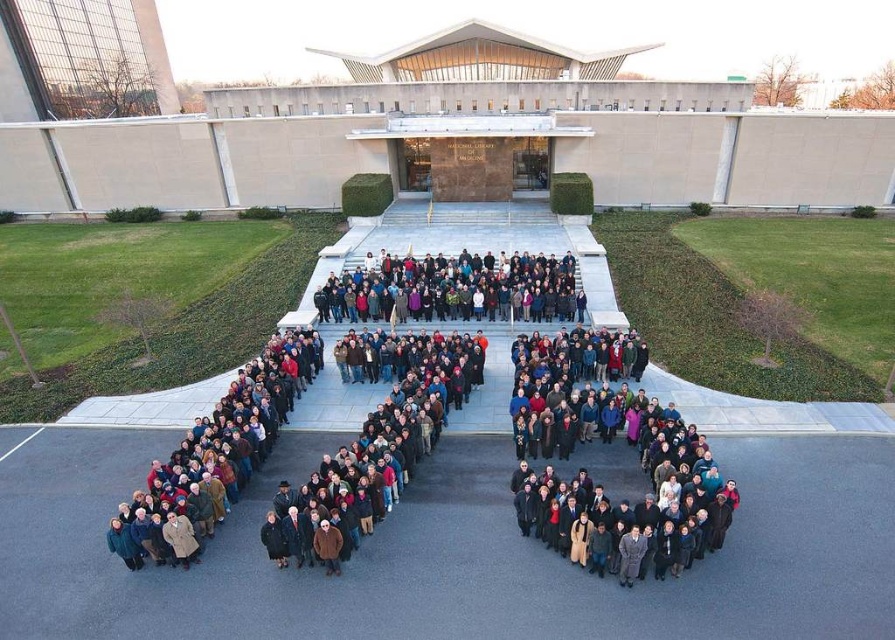
Consider the image. You are a photographer trying to capture the heart formation from above. You notice the dark brown coat at center and the dark gray fabric crowd at center. Which object is wider in the image?

The dark brown coat at center is wider than the dark gray fabric crowd at center according to the description.

You are a photographer trying to capture the heart formation from above. You notice the dark brown coat at center and the dark gray fabric crowd at center. Which object takes up more space in the photo?

The dark brown coat at center has a larger size compared to dark gray fabric crowd at center, so it takes up more space in the photo.

You are standing in front of the National Library of Medicine and notice a dark brown coat at center and a dark gray fabric crowd at center. Which object is nearer to you?

The dark brown coat at center is closer to the viewer than the dark gray fabric crowd at center.